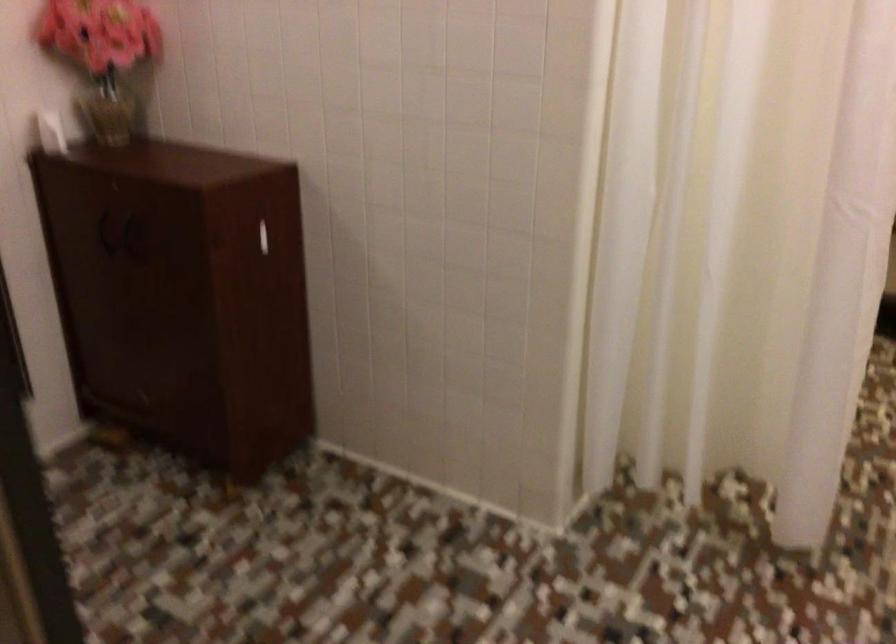
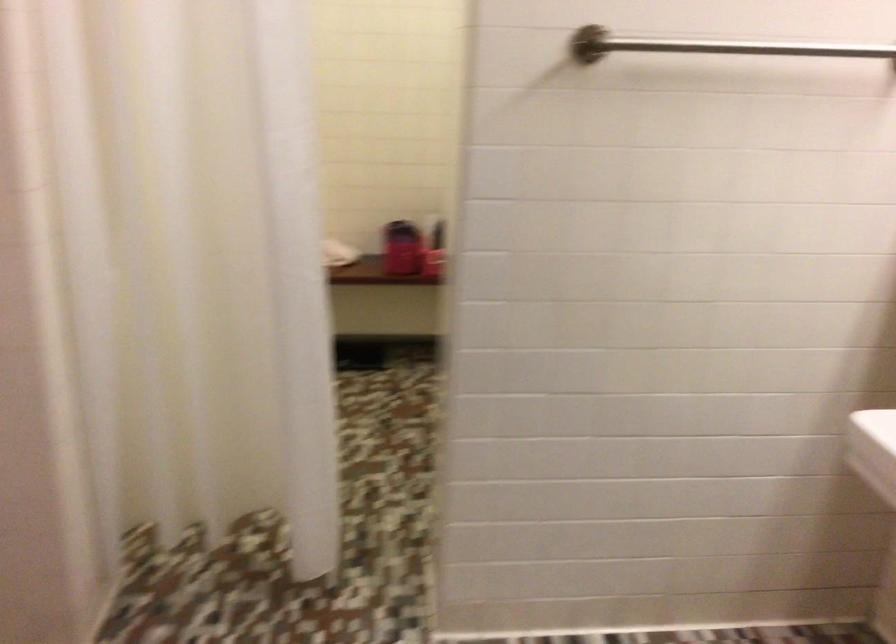
Question: Based on the continuous images, in which direction is the camera rotating? Reply with the corresponding letter.

Choices:
 (A) Left
 (B) Right
 (C) Up
 (D) Down

Answer: (B)